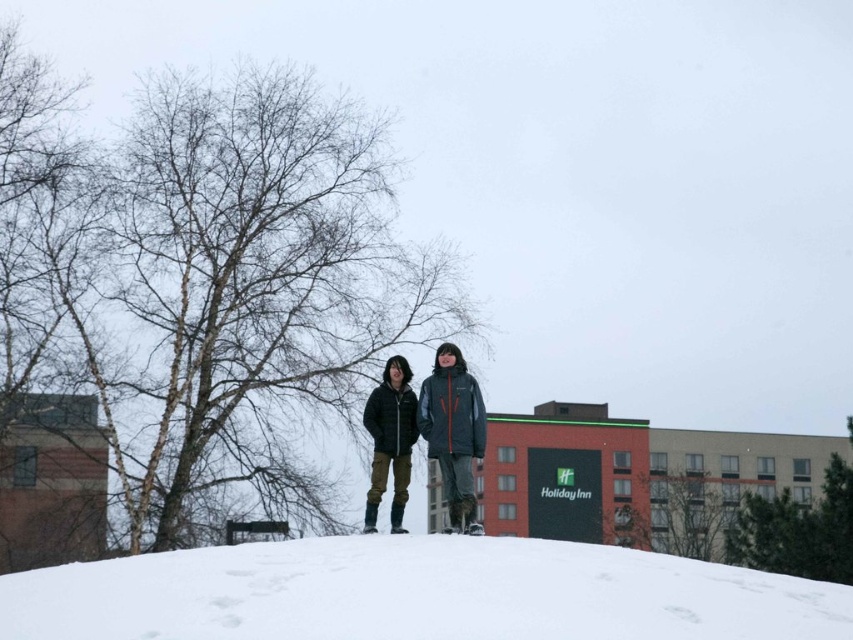
Can you confirm if white fluffy snow at center is positioned to the left of matte black jacket at center?

Yes, white fluffy snow at center is to the left of matte black jacket at center.

Who is positioned more to the right, white fluffy snow at center or matte black jacket at center?

Positioned to the right is matte black jacket at center.

You are a GUI agent. You are given a task and a screenshot of the screen. Output one action in this format:
    pyautogui.click(x=<x>, y=<y>)
    Task: Click on the white fluffy snow at center
    The image size is (853, 640).
    Given the screenshot: What is the action you would take?
    pyautogui.click(x=416, y=593)